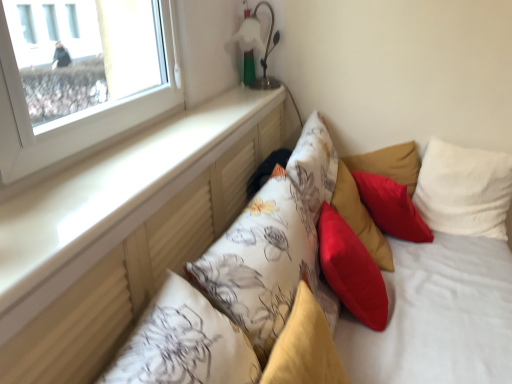
What do you see at coordinates (351, 270) in the screenshot? I see `smooth red cushion at center, positioned as the 4th pillow in right-to-left order` at bounding box center [351, 270].

At what (x,y) coordinates should I click in order to perform the action: click on metallic silver table lamp at upper center. Please return your answer as a coordinate pair (x, y). Looking at the image, I should click on (257, 48).

The image size is (512, 384). Describe the element at coordinates (257, 48) in the screenshot. I see `metallic silver table lamp at upper center` at that location.

This screenshot has width=512, height=384. What do you see at coordinates (391, 207) in the screenshot?
I see `red matte pillow at upper right, which is the fifth pillow from left to right` at bounding box center [391, 207].

Identify the location of smooth red cushion at center, the 3th pillow viewed from the left. The image size is (512, 384). (351, 270).

Does silky red cushion at center, the fourth pillow when ordered from left to right, have a larger size compared to metallic silver table lamp at upper center?

Indeed, silky red cushion at center, the fourth pillow when ordered from left to right, has a larger size compared to metallic silver table lamp at upper center.

Based on the photo, is silky red cushion at center, which is the 3th pillow from right to left, shorter than metallic silver table lamp at upper center?

In fact, silky red cushion at center, which is the 3th pillow from right to left, may be taller than metallic silver table lamp at upper center.

Is silky red cushion at center, which is the 3th pillow from right to left, aimed at metallic silver table lamp at upper center?

No.

Does floral fabric pillow at center, which is the 6th pillow in right-to-left order, have a lesser height compared to silky red cushion at center, which is the 3th pillow from right to left?

No.

Measure the distance between floral fabric pillow at center, arranged as the 1th pillow when viewed from the left, and silky red cushion at center, which is the 3th pillow from right to left.

18.43 inches.

From the image's perspective, is floral fabric pillow at center, which is the 6th pillow in right-to-left order, above or below silky red cushion at center, which is the 3th pillow from right to left?

floral fabric pillow at center, which is the 6th pillow in right-to-left order, is situated lower than silky red cushion at center, which is the 3th pillow from right to left, in the image.

Which object is further away from the camera, floral fabric pillow at center, arranged as the 1th pillow when viewed from the left, or silky red cushion at center, which is the 3th pillow from right to left?

Positioned behind is silky red cushion at center, which is the 3th pillow from right to left.

Is smooth red cushion at center, the 3th pillow viewed from the left, to the left of fluffy yellow pillow at center, the second pillow from the left, from the viewer's perspective?

Incorrect, smooth red cushion at center, the 3th pillow viewed from the left, is not on the left side of fluffy yellow pillow at center, the second pillow from the left.

Where is `the 1st pillow counting from the right of the fluffy yellow pillow at center, the second pillow from the left`? The width and height of the screenshot is (512, 384). the 1st pillow counting from the right of the fluffy yellow pillow at center, the second pillow from the left is located at coordinates (351, 270).

Can you confirm if smooth red cushion at center, the 3th pillow viewed from the left, is wider than fluffy yellow pillow at center, which is counted as the 5th pillow, starting from the right?

Indeed, smooth red cushion at center, the 3th pillow viewed from the left, has a greater width compared to fluffy yellow pillow at center, which is counted as the 5th pillow, starting from the right.

Is white soft pillow at upper right, arranged as the first pillow when viewed from the right, at the left side of floral fabric pillow at center, which is the 6th pillow in right-to-left order?

No.

From the image's perspective, which one is positioned lower, white soft pillow at upper right, arranged as the first pillow when viewed from the right, or floral fabric pillow at center, which is the 6th pillow in right-to-left order?

floral fabric pillow at center, which is the 6th pillow in right-to-left order, is shown below in the image.

In terms of height, does white soft pillow at upper right, which is the sixth pillow from left to right, look taller or shorter compared to floral fabric pillow at center, which is the 6th pillow in right-to-left order?

Clearly, white soft pillow at upper right, which is the sixth pillow from left to right, is shorter compared to floral fabric pillow at center, which is the 6th pillow in right-to-left order.

Which point is more forward, (465,213) or (252,336)?

Point (252,336)

The image size is (512, 384). Find the location of `the 4th pillow directly beneath the metallic silver table lamp at upper center (from a real-world perspective)`. the 4th pillow directly beneath the metallic silver table lamp at upper center (from a real-world perspective) is located at coordinates (304, 347).

Who is bigger, fluffy yellow pillow at center, which is counted as the 5th pillow, starting from the right, or metallic silver table lamp at upper center?

fluffy yellow pillow at center, which is counted as the 5th pillow, starting from the right, is bigger.

Is point (320, 321) positioned in front of point (255, 26)?

Yes, point (320, 321) is in front of point (255, 26).

Is fluffy yellow pillow at center, the second pillow from the left, aimed at metallic silver table lamp at upper center?

No, fluffy yellow pillow at center, the second pillow from the left, is not facing towards metallic silver table lamp at upper center.

Consider the image. Is fluffy yellow pillow at center, which is counted as the 5th pillow, starting from the right, positioned with its back to white soft pillow at upper right, arranged as the first pillow when viewed from the right?

No, fluffy yellow pillow at center, which is counted as the 5th pillow, starting from the right, is not facing away from white soft pillow at upper right, arranged as the first pillow when viewed from the right.

Is point (308, 314) closer to camera compared to point (485, 162)?

Yes, it is in front of point (485, 162).

Can you confirm if fluffy yellow pillow at center, which is counted as the 5th pillow, starting from the right, is positioned to the right of white soft pillow at upper right, arranged as the first pillow when viewed from the right?

Result: No, fluffy yellow pillow at center, which is counted as the 5th pillow, starting from the right, is not to the right of white soft pillow at upper right, arranged as the first pillow when viewed from the right.

Which is correct: fluffy yellow pillow at center, the second pillow from the left, is inside white soft pillow at upper right, which is the sixth pillow from left to right, or outside of it?

fluffy yellow pillow at center, the second pillow from the left, cannot be found inside white soft pillow at upper right, which is the sixth pillow from left to right.

Can you confirm if white matte window sill at upper left is shorter than white soft pillow at upper right, which is the sixth pillow from left to right?

Yes, white matte window sill at upper left is shorter than white soft pillow at upper right, which is the sixth pillow from left to right.

From the image's perspective, is white matte window sill at upper left below white soft pillow at upper right, arranged as the first pillow when viewed from the right?

Incorrect, from the image's perspective, white matte window sill at upper left is higher than white soft pillow at upper right, arranged as the first pillow when viewed from the right.

Considering the relative sizes of white matte window sill at upper left and white soft pillow at upper right, which is the sixth pillow from left to right, in the image provided, is white matte window sill at upper left thinner than white soft pillow at upper right, which is the sixth pillow from left to right,?

Incorrect, the width of white matte window sill at upper left is not less than that of white soft pillow at upper right, which is the sixth pillow from left to right.

Is white matte window sill at upper left situated inside white soft pillow at upper right, arranged as the first pillow when viewed from the right, or outside?

white matte window sill at upper left is not inside white soft pillow at upper right, arranged as the first pillow when viewed from the right, it's outside.

Image resolution: width=512 pixels, height=384 pixels. I want to click on the 6th pillow below the metallic silver table lamp at upper center (from a real-world perspective), so click(360, 218).

You are a GUI agent. You are given a task and a screenshot of the screen. Output one action in this format:
    pyautogui.click(x=<x>, y=<y>)
    Task: Click on the 2nd pillow behind when counting from the floral fabric pillow at center, which is the 6th pillow in right-to-left order
    This screenshot has width=512, height=384.
    Given the screenshot: What is the action you would take?
    (x=360, y=218)

Looking at the image, which one is located further to silky red cushion at center, the fourth pillow when ordered from left to right, floral fabric pillow at center, which is the 6th pillow in right-to-left order, or red matte pillow at upper right, the second pillow from the right?

floral fabric pillow at center, which is the 6th pillow in right-to-left order.

Estimate the real-world distances between objects in this image. Which object is closer to metallic silver table lamp at upper center, red matte pillow at upper right, which is the fifth pillow from left to right, or white soft pillow at upper right, arranged as the first pillow when viewed from the right?

The object closer to metallic silver table lamp at upper center is red matte pillow at upper right, which is the fifth pillow from left to right.

Considering their positions, is white matte window sill at upper left positioned closer to red matte pillow at upper right, the second pillow from the right, than floral fabric pillow at center, arranged as the 1th pillow when viewed from the left?

floral fabric pillow at center, arranged as the 1th pillow when viewed from the left, is positioned closer to the anchor red matte pillow at upper right, the second pillow from the right.

Consider the image. Considering their positions, is red matte pillow at upper right, the second pillow from the right, positioned closer to metallic silver table lamp at upper center than silky red cushion at center, the fourth pillow when ordered from left to right?

Based on the image, silky red cushion at center, the fourth pillow when ordered from left to right, appears to be nearer to metallic silver table lamp at upper center.

Which object lies nearer to the anchor point white matte window sill at upper left, smooth red cushion at center, the 3th pillow viewed from the left, or fluffy yellow pillow at center, the second pillow from the left?

fluffy yellow pillow at center, the second pillow from the left, is positioned closer to the anchor white matte window sill at upper left.

Considering their positions, is red matte pillow at upper right, which is the fifth pillow from left to right, positioned closer to metallic silver table lamp at upper center than fluffy yellow pillow at center, which is counted as the 5th pillow, starting from the right?

red matte pillow at upper right, which is the fifth pillow from left to right.

From the picture: Based on their spatial positions, is metallic silver table lamp at upper center or smooth red cushion at center, positioned as the 4th pillow in right-to-left order, further from floral fabric pillow at center, which is the 6th pillow in right-to-left order?

metallic silver table lamp at upper center.

Based on their spatial positions, is red matte pillow at upper right, the second pillow from the right, or white matte window sill at upper left further from floral fabric pillow at center, which is the 6th pillow in right-to-left order?

red matte pillow at upper right, the second pillow from the right, lies further to floral fabric pillow at center, which is the 6th pillow in right-to-left order, than the other object.

The height and width of the screenshot is (384, 512). What are the coordinates of `table lamp between fluffy yellow pillow at center, which is counted as the 5th pillow, starting from the right, and red matte pillow at upper right, the second pillow from the right, in the front-back direction` in the screenshot? It's located at (257, 48).

You are a GUI agent. You are given a task and a screenshot of the screen. Output one action in this format:
    pyautogui.click(x=<x>, y=<y>)
    Task: Click on the table lamp between floral fabric pillow at center, which is the 6th pillow in right-to-left order, and red matte pillow at upper right, which is the fifth pillow from left to right, along the z-axis
    This screenshot has width=512, height=384.
    Given the screenshot: What is the action you would take?
    pyautogui.click(x=257, y=48)

Find the location of a particular element. table lamp between white matte window sill at upper left and red matte pillow at upper right, the second pillow from the right, in the front-back direction is located at coordinates (257, 48).

Find the location of `pillow between floral fabric pillow at center, arranged as the 1th pillow when viewed from the left, and silky red cushion at center, which is the 3th pillow from right to left, from front to back`. pillow between floral fabric pillow at center, arranged as the 1th pillow when viewed from the left, and silky red cushion at center, which is the 3th pillow from right to left, from front to back is located at coordinates (351, 270).